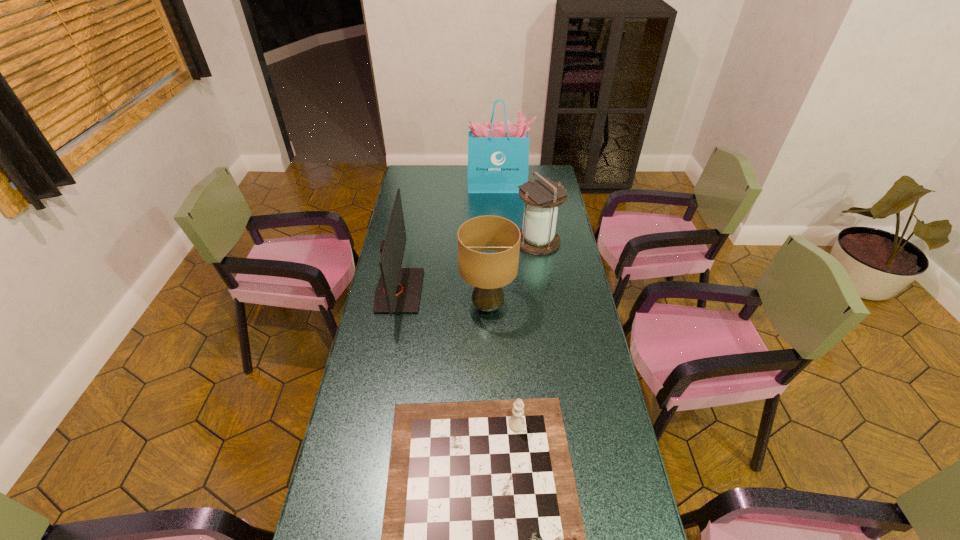
Locate which object ranks second in proximity to the lampshade. Please provide its 2D coordinates. Your answer should be formatted as a tuple, i.e. [(x, y)], where the tuple contains the x and y coordinates of a point satisfying the conditions above.

[(542, 197)]

Locate an element on the screen. The width and height of the screenshot is (960, 540). vacant space that satisfies the following two spatial constraints: 1. on the screen side of the monitor; 2. on the back side of the lampshade is located at coordinates (396, 307).

Identify the location of free spot that satisfies the following two spatial constraints: 1. on the screen side of the monitor; 2. on the left side of the lampshade. (396, 307).

Identify the location of free location that satisfies the following two spatial constraints: 1. on the screen side of the lampshade; 2. on the right side of the monitor. The width and height of the screenshot is (960, 540). (396, 307).

Find the location of a particular element. This screenshot has width=960, height=540. free spot that satisfies the following two spatial constraints: 1. on the screen side of the monitor; 2. on the right side of the lampshade is located at coordinates (396, 307).